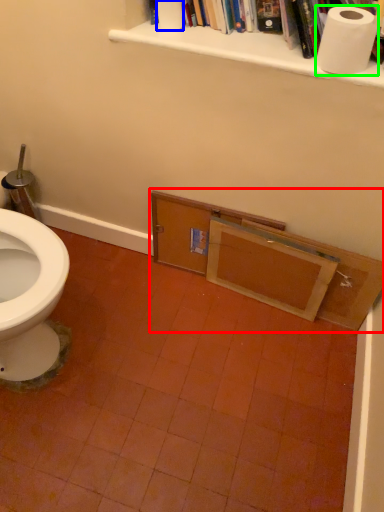
Question: Which object is the farthest from vanity (highlighted by a red box)? Choose among these: toilet paper (highlighted by a blue box) or toilet paper (highlighted by a green box).

Choices:
 (A) toilet paper
 (B) toilet paper

Answer: (A)